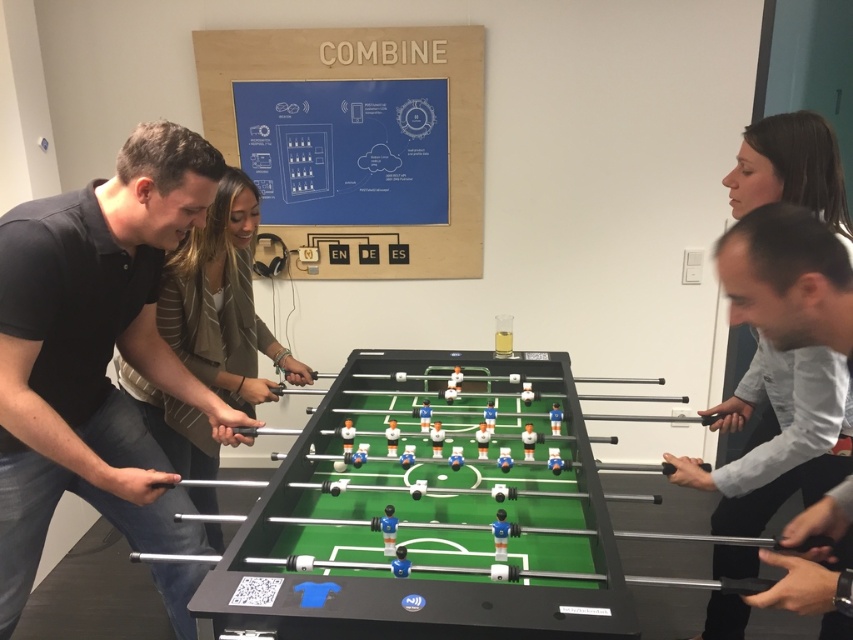
From the picture: You are a robot with a camera mounted at the center of your body. Your camera has a field of view that can see objects within a radius of 2 meters. You are positioned at the point marked as point (x=445, y=408). Can you see the other point through your camera?

The two points are 2.12 meters apart. Since the camera has a 2 meter radius, the distance is beyond its range. Therefore, you cannot see the other point through your camera.